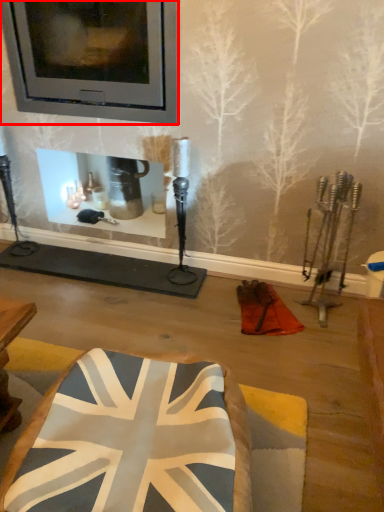
Question: From the image's perspective, where is picture frame (annotated by the red box) located relative to furniture?

Choices:
 (A) below
 (B) above

Answer: (B)